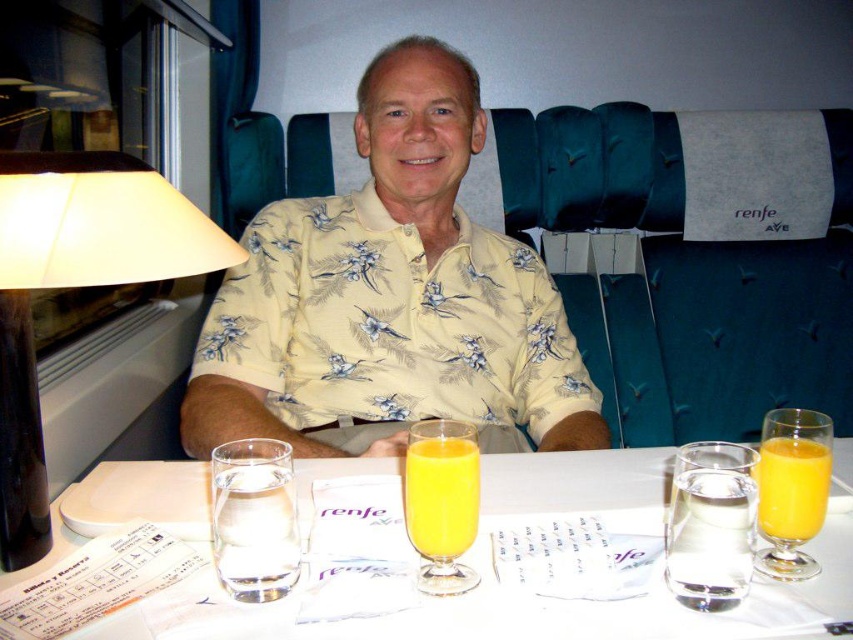
You are a passenger in the train compartment and want to place your bag on the table. The matte black lampshade at left and the clear glass water at center are already on the table. Which object can you move to make more space for your bag?

The matte black lampshade at left occupies less space than the clear glass water at center, so you should move the matte black lampshade at left to make more space for your bag.

You are a passenger in the train compartment and want to place your phone on the table. The phone is 15 cm long. Is there enough space between the matte black lampshade at left and the orange liquid at table right to place your phone horizontally?

The matte black lampshade at left is bigger than the orange liquid at table right, but the exact distance between them isn not specified. Without knowing the distance, it is impossible to determine if there is enough space for the phone.

You are a passenger on the train and want to reach for the clear glass water at center and the orange liquid at center. Which one is closer to you?

The distance between the clear glass water at center and the orange liquid at center is 19.08 centimeters, so they are both equidistant from you since they are at the same central position.